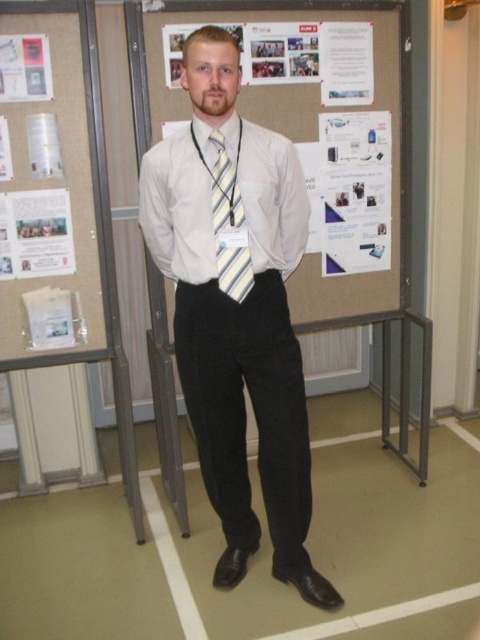
You are a security guard in a building and you need to verify the ID badge of the person in the image. The ID badge is attached to the lanyard worn by the man. Since the ID badge is not clearly visible, can you estimate the coordinates where the lanyard is located based on the position of the white smooth shirt at center?

The lanyard is likely located near the position of the white smooth shirt at center, which is at coordinates point [237,308].

You are an event planner organizing a formal event. You need to decide which item to place first in the venue setup. Since the white smooth dress shirt at center is larger than the matte paper poster at upper left, which item should you prioritize placing first based on size?

The white smooth dress shirt at center is larger than the matte paper poster at upper left, so you should prioritize placing the white smooth dress shirt at center first.